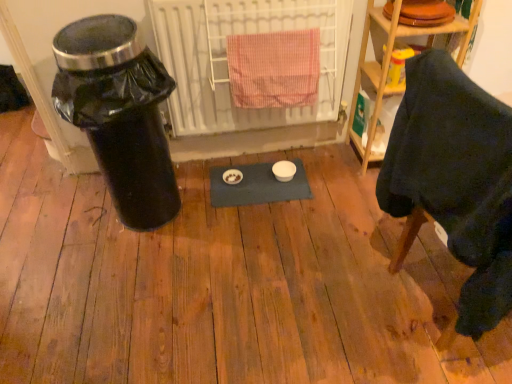
You are a GUI agent. You are given a task and a screenshot of the screen. Output one action in this format:
    pyautogui.click(x=<x>, y=<y>)
    Task: Click on the vacant space that is in between wooden shelf at upper right and black plastic trash can at left
    
    Given the screenshot: What is the action you would take?
    pyautogui.click(x=273, y=178)